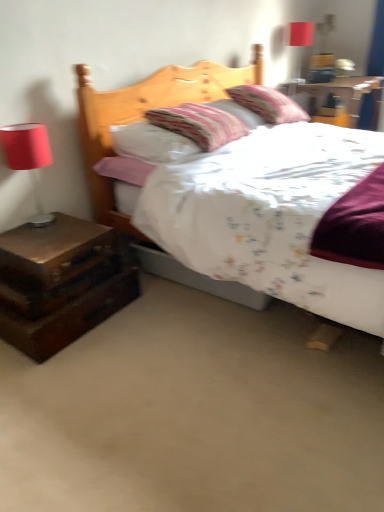
Question: From a real-world perspective, relative to matte red lampshade at upper right, is brown wooden nightstand at left, acting as the 3th nightstand starting from the right, vertically above or below?

Choices:
 (A) above
 (B) below

Answer: (B)

Question: In the image, is brown wooden nightstand at left, the first nightstand in the front-to-back sequence, on the left side or the right side of matte red lampshade at upper right?

Choices:
 (A) right
 (B) left

Answer: (B)

Question: Which object is the farthest from the dark wood nightstand at lower left, which appears as the second nightstand when viewed from the right?

Choices:
 (A) wooden nightstand at upper right, marked as the 3th nightstand in a left-to-right arrangement
 (B) matte red lampshade at left
 (C) wooden drawer at left
 (D) fluffy cotton pillow at upper center, which is counted as the 1th pillow, starting from the back
 (E) striped fabric pillow at center, acting as the 1th pillow starting from the front

Answer: (A)

Question: Which is nearer to the wooden nightstand at upper right, the 3th nightstand when ordered from front to back?

Choices:
 (A) matte red lampshade at upper right
 (B) matte red lampshade at left
 (C) wooden drawer at left
 (D) fluffy cotton pillow at upper center, which is counted as the 1th pillow, starting from the back
 (E) dark wood nightstand at lower left, the 3th nightstand positioned from the top

Answer: (A)